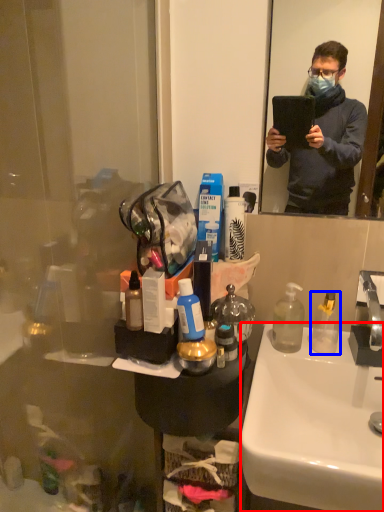
Question: Which object is further to the camera taking this photo, sink (highlighted by a red box) or bottle (highlighted by a blue box)?

Choices:
 (A) sink
 (B) bottle

Answer: (B)